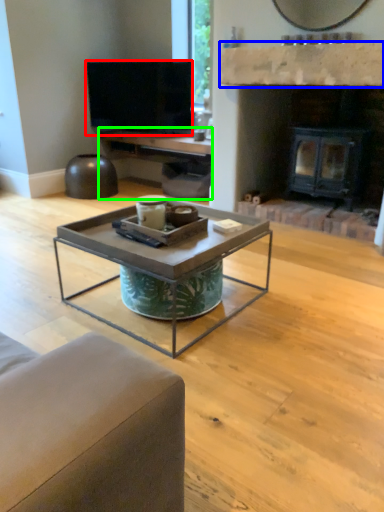
Question: Considering the real-world distances, which object is closest to television (highlighted by a red box)? mantle (highlighted by a blue box) or entertainment center (highlighted by a green box).

Choices:
 (A) mantle
 (B) entertainment center

Answer: (B)